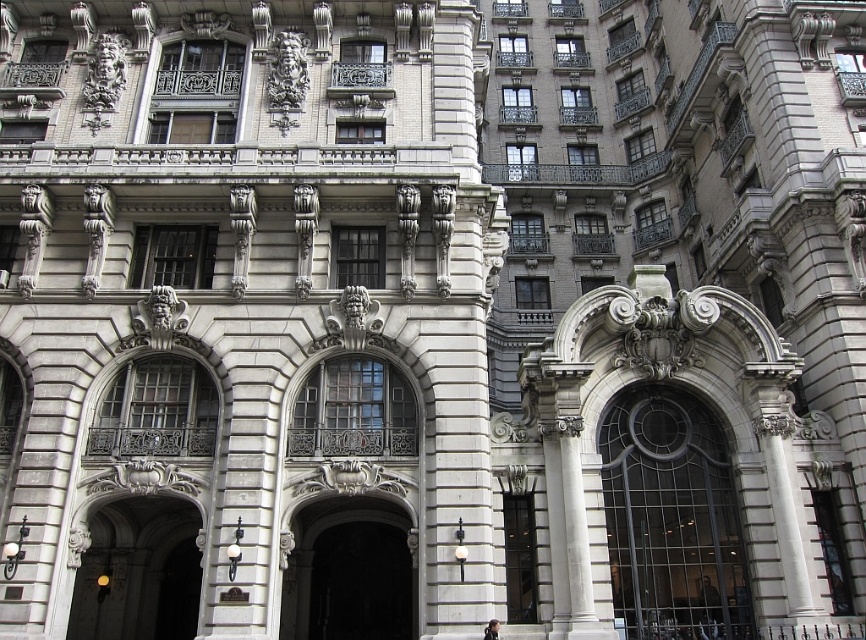
Question: Does black glass door at center appear under polished bronze door at center?

Choices:
 (A) no
 (B) yes

Answer: (A)

Question: Which of the following is the farthest from the observer?

Choices:
 (A) polished bronze door at center
 (B) black glass door at center

Answer: (B)

Question: Which point is farther to the camera?

Choices:
 (A) black glass door at center
 (B) dark gray stone archway at center

Answer: (A)

Question: From the image, what is the correct spatial relationship of black glass door at center in relation to polished bronze door at center?

Choices:
 (A) above
 (B) below

Answer: (A)

Question: Which object appears farthest from the camera in this image?

Choices:
 (A) dark gray stone archway at center
 (B) polished bronze door at center
 (C) black glass door at center

Answer: (C)

Question: Where is black glass door at center located in relation to dark gray stone archway at center in the image?

Choices:
 (A) left
 (B) right

Answer: (B)